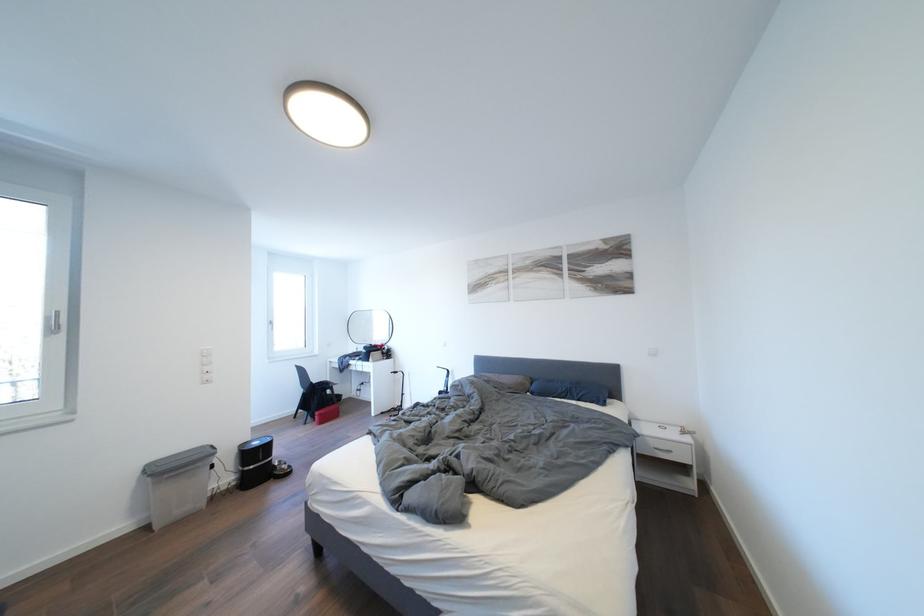
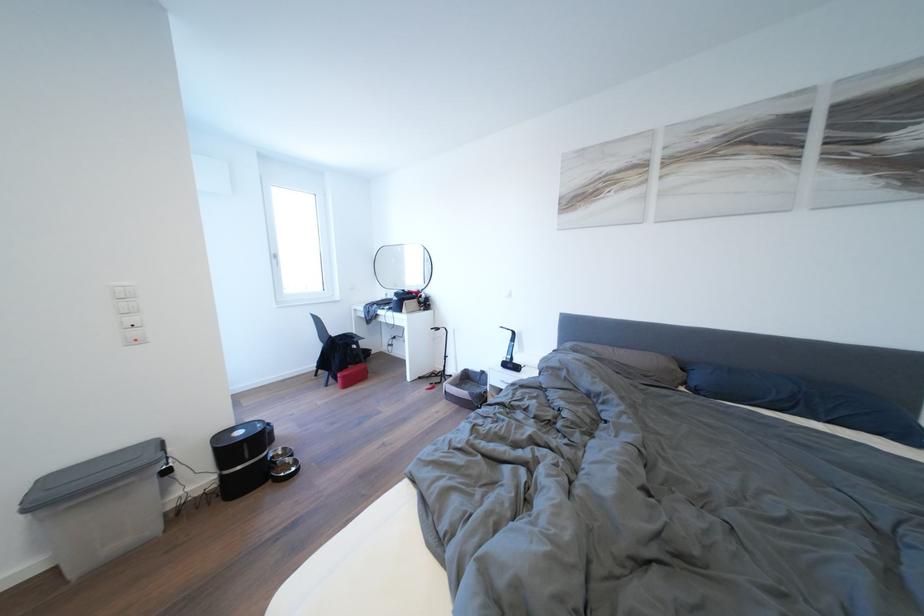
Locate, in the second image, the point that corresponds to point (541, 398) in the first image.

(703, 395)